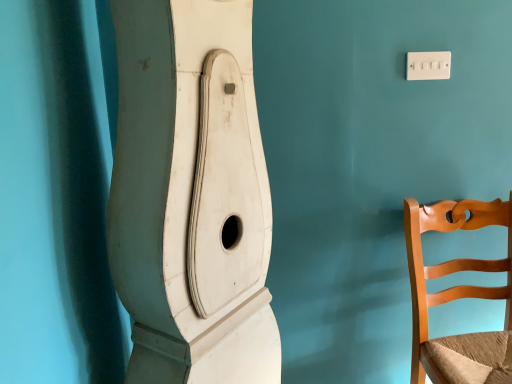
What is the approximate width of white plastic light switch at upper right?

It is 1.97 centimeters.

Describe the element at coordinates (428, 65) in the screenshot. I see `white plastic light switch at upper right` at that location.

Where is `white plastic light switch at upper right`? white plastic light switch at upper right is located at coordinates (428, 65).

Where is `light brown wooden chair at right`? This screenshot has width=512, height=384. light brown wooden chair at right is located at coordinates (458, 296).

Describe the element at coordinates (458, 296) in the screenshot. I see `light brown wooden chair at right` at that location.

What are the coordinates of `white plastic light switch at upper right` in the screenshot? It's located at (428, 65).

Which object is positioned more to the left, white plastic light switch at upper right or light brown wooden chair at right?

white plastic light switch at upper right is more to the left.

Who is more distant, white plastic light switch at upper right or light brown wooden chair at right?

white plastic light switch at upper right is further from the camera.

Which point is more forward, (445, 64) or (474, 382)?

The point (474, 382) is more forward.

From the image's perspective, is white plastic light switch at upper right beneath light brown wooden chair at right?

No, from the image's perspective, white plastic light switch at upper right is not below light brown wooden chair at right.

From a real-world perspective, is white plastic light switch at upper right on light brown wooden chair at right?

A: Correct, in the physical world, white plastic light switch at upper right is higher than light brown wooden chair at right.

Between white plastic light switch at upper right and light brown wooden chair at right, which one has smaller width?

white plastic light switch at upper right is thinner.

Between white plastic light switch at upper right and light brown wooden chair at right, which one has more height?

Standing taller between the two is light brown wooden chair at right.

Based on their sizes in the image, would you say white plastic light switch at upper right is bigger or smaller than light brown wooden chair at right?

white plastic light switch at upper right is smaller than light brown wooden chair at right.

Is white plastic light switch at upper right outside of light brown wooden chair at right?

Indeed, white plastic light switch at upper right is completely outside light brown wooden chair at right.

Is white plastic light switch at upper right positioned far away from light brown wooden chair at right?

white plastic light switch at upper right is actually quite close to light brown wooden chair at right.

Is white plastic light switch at upper right turned away from light brown wooden chair at right?

No, white plastic light switch at upper right's orientation is not away from light brown wooden chair at right.

What's the angular difference between white plastic light switch at upper right and light brown wooden chair at right's facing directions?

They differ by 0.02 degrees in their facing directions.

Locate an element on the screen. This screenshot has width=512, height=384. light switch above the light brown wooden chair at right (from a real-world perspective) is located at coordinates (428, 65).

Considering the positions of objects light brown wooden chair at right and white plastic light switch at upper right in the image provided, who is more to the right, light brown wooden chair at right or white plastic light switch at upper right?

From the viewer's perspective, light brown wooden chair at right appears more on the right side.

Between light brown wooden chair at right and white plastic light switch at upper right, which one is positioned behind?

white plastic light switch at upper right is more distant.

Does point (438, 208) appear closer or farther from the camera than point (418, 72)?

Point (438, 208) is positioned farther from the camera compared to point (418, 72).

From the image's perspective, between light brown wooden chair at right and white plastic light switch at upper right, who is located below?

light brown wooden chair at right is shown below in the image.

In the scene shown: From a real-world perspective, is light brown wooden chair at right under white plastic light switch at upper right?

Correct, in the physical world, light brown wooden chair at right is lower than white plastic light switch at upper right.

From the picture: Can you confirm if light brown wooden chair at right is thinner than white plastic light switch at upper right?

No.

Who is shorter, light brown wooden chair at right or white plastic light switch at upper right?

white plastic light switch at upper right is shorter.

In terms of size, does light brown wooden chair at right appear bigger or smaller than white plastic light switch at upper right?

In the image, light brown wooden chair at right appears to be larger than white plastic light switch at upper right.

Is light brown wooden chair at right situated inside white plastic light switch at upper right or outside?

light brown wooden chair at right is spatially situated outside white plastic light switch at upper right.

Is light brown wooden chair at right not close to white plastic light switch at upper right?

No.

Is white plastic light switch at upper right at the back of light brown wooden chair at right?

No, light brown wooden chair at right is not facing away from white plastic light switch at upper right.

How different are the orientations of light brown wooden chair at right and white plastic light switch at upper right in degrees?

The angle between the facing direction of light brown wooden chair at right and the facing direction of white plastic light switch at upper right is 0.02 degrees.

Identify the location of light switch located above the light brown wooden chair at right (from a real-world perspective). The image size is (512, 384). (428, 65).

Identify the location of light switch to the left of light brown wooden chair at right. Image resolution: width=512 pixels, height=384 pixels. click(x=428, y=65).

The image size is (512, 384). Find the location of `chair that appears below the white plastic light switch at upper right (from the image's perspective)`. chair that appears below the white plastic light switch at upper right (from the image's perspective) is located at coordinates coord(458,296).